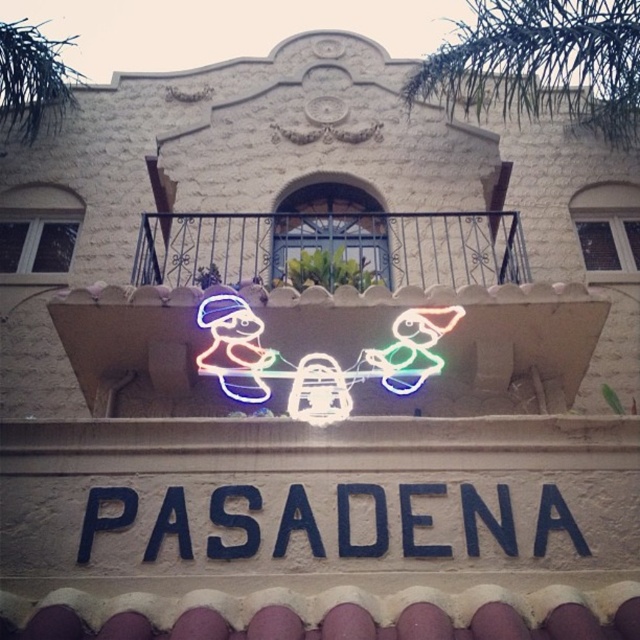
Question: Is neon lights at center above blue painted sign at center?

Choices:
 (A) yes
 (B) no

Answer: (A)

Question: Is the position of blue painted sign at center more distant than that of neonflexible/lightingsanta figures at center?

Choices:
 (A) no
 (B) yes

Answer: (A)

Question: Is metallic wrought iron at upper center below green leafy palm tree at upper left?

Choices:
 (A) no
 (B) yes

Answer: (B)

Question: Which object is the closest to the blue painted sign at center?

Choices:
 (A) neonflexible/lightingsanta figures at center
 (B) metallic wrought iron at upper center
 (C) green leafy palm tree at upper right
 (D) neon lights at center

Answer: (A)

Question: Which of the following is the farthest from the observer?

Choices:
 (A) green leafy palm tree at upper right
 (B) metallic wrought iron at upper center
 (C) neonflexible/lightingsanta figures at center
 (D) neon lights at center

Answer: (A)

Question: Which point is closer to the camera taking this photo?

Choices:
 (A) (333, 358)
 (B) (561, 528)
 (C) (632, 96)
 (D) (488, 288)

Answer: (B)